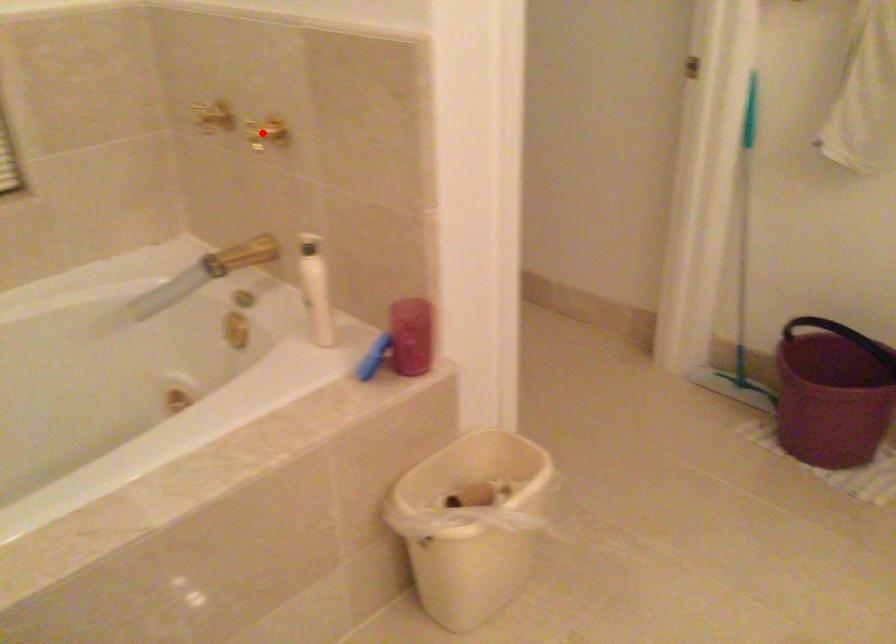
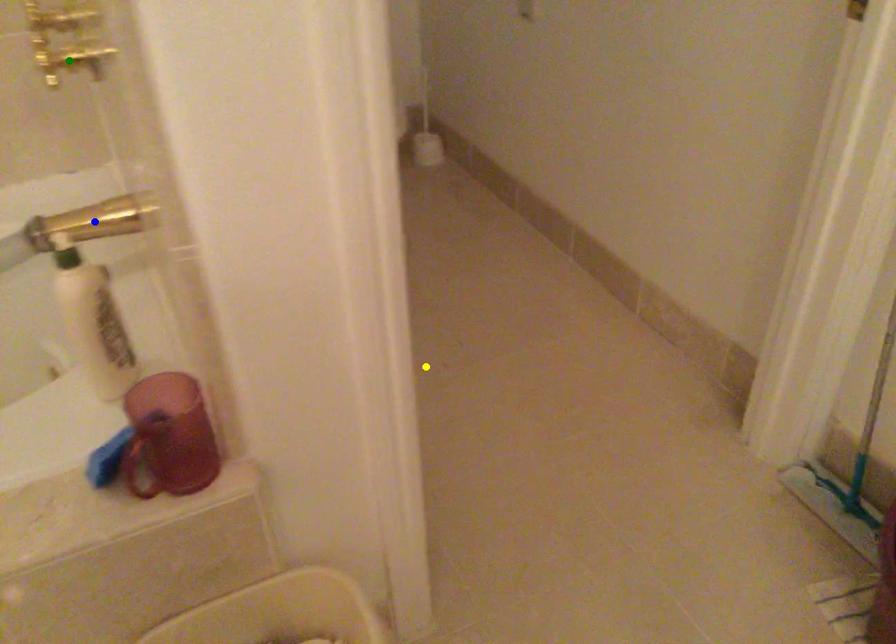
Question: I am providing you with two images of the same scene from different viewpoints. A red point is marked on the first image. You are given multiple points on the second image. Which mark in image 2 goes with the point in image 1?

Choices:
 (A) yellow point
 (B) blue point
 (C) green point

Answer: (C)